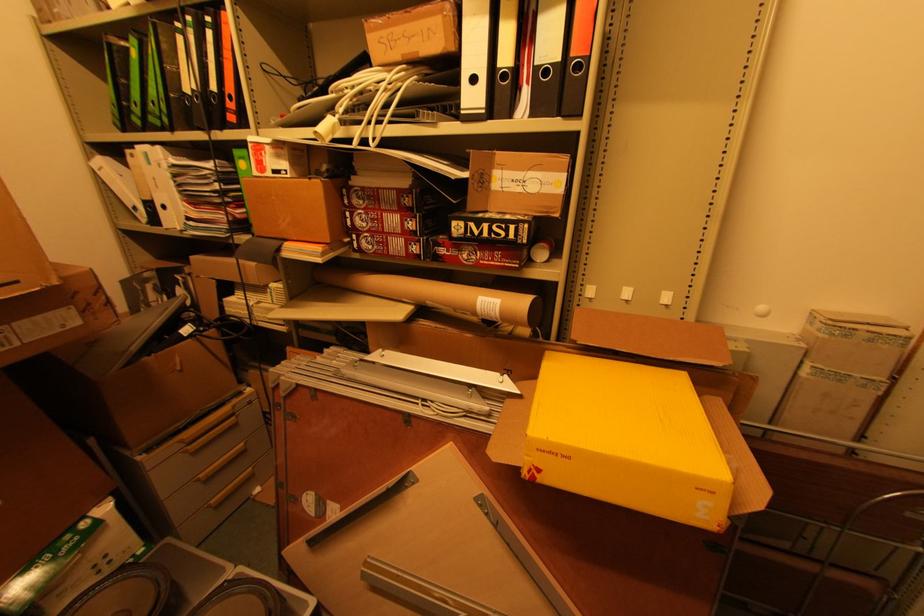
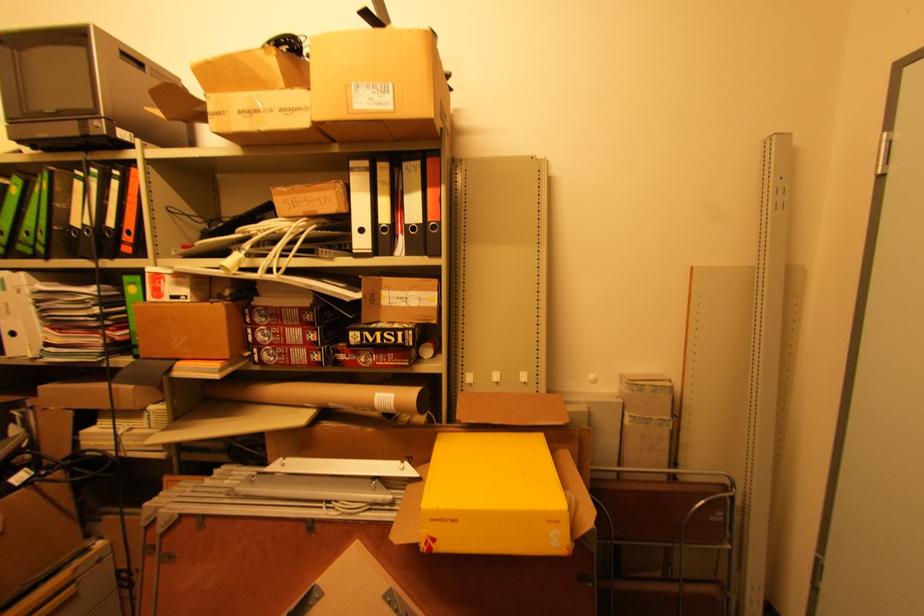
In the second image, find the point that corresponds to [554,453] in the first image.

(444, 521)